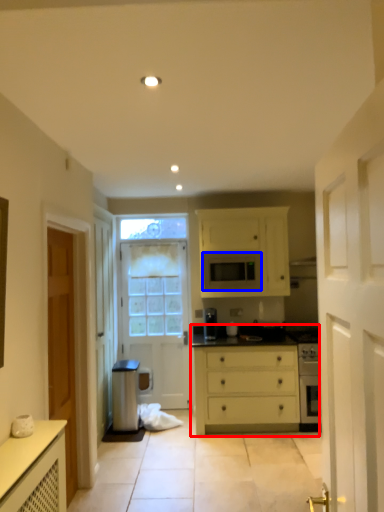
Question: Among these objects, which one is nearest to the camera, chest of drawers (highlighted by a red box) or microwave oven (highlighted by a blue box)?

Choices:
 (A) chest of drawers
 (B) microwave oven

Answer: (A)